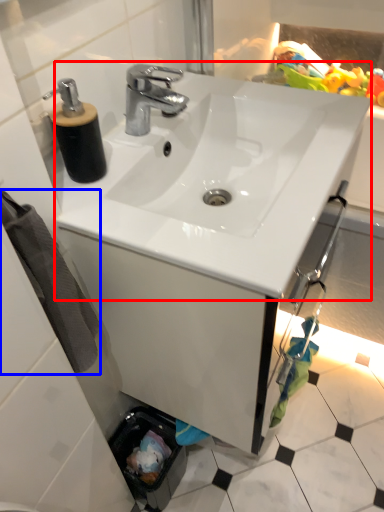
Question: Which object appears closest to the camera in this image, sink (highlighted by a red box) or bath towel (highlighted by a blue box)?

Choices:
 (A) sink
 (B) bath towel

Answer: (B)